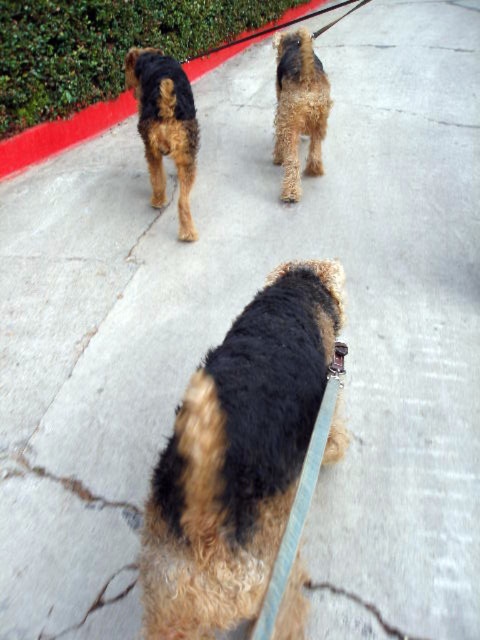
Question: Which object appears farthest from the camera in this image?

Choices:
 (A) golden-brown fur dog at upper left
 (B) golden-brown fur at center

Answer: (B)

Question: Does golden-brown fur dog at upper left have a greater width compared to golden-brown fur at center?

Choices:
 (A) yes
 (B) no

Answer: (A)

Question: Does golden-brown fur dog at center have a smaller size compared to golden-brown fur dog at upper left?

Choices:
 (A) yes
 (B) no

Answer: (A)

Question: Estimate the real-world distances between objects in this image. Which object is closer to the golden-brown fur dog at upper left?

Choices:
 (A) golden-brown fur at center
 (B) golden-brown fur dog at center

Answer: (A)

Question: Which point is farther to the camera?

Choices:
 (A) (310, 129)
 (B) (228, 568)

Answer: (A)

Question: Does golden-brown fur dog at center have a smaller size compared to golden-brown fur at center?

Choices:
 (A) yes
 (B) no

Answer: (A)